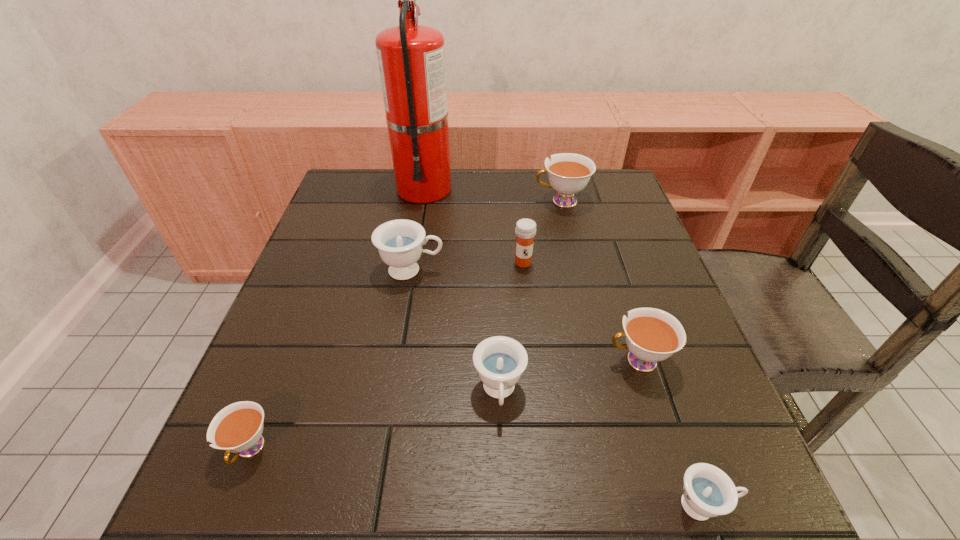
Identify the location of red fire extinguisher. (411, 58).

Locate an element on the screen. The image size is (960, 540). fire extinguisher is located at coordinates (411, 58).

The image size is (960, 540). I want to click on the farthest white teacup, so (x=568, y=173).

You are a GUI agent. You are given a task and a screenshot of the screen. Output one action in this format:
    pyautogui.click(x=<x>, y=<y>)
    Task: Click on the farthest teacup
    
    Given the screenshot: What is the action you would take?
    pyautogui.click(x=568, y=173)

You are a GUI agent. You are given a task and a screenshot of the screen. Output one action in this format:
    pyautogui.click(x=<x>, y=<y>)
    Task: Click on the medicine
    
    Given the screenshot: What is the action you would take?
    pyautogui.click(x=525, y=230)

At what (x,y) coordinates should I click in order to perform the action: click on the biggest blue teacup. Please return your answer as a coordinate pair (x, y). The height and width of the screenshot is (540, 960). Looking at the image, I should click on (399, 242).

Find the location of a particular element. The height and width of the screenshot is (540, 960). the leftmost blue teacup is located at coordinates (399, 242).

Find the location of `the second smallest white teacup`. the second smallest white teacup is located at coordinates (652, 335).

At what (x,y) coordinates should I click in order to perform the action: click on the second nearest blue teacup. Please return your answer as a coordinate pair (x, y). Looking at the image, I should click on (500, 361).

Identify the location of the second biggest blue teacup. The width and height of the screenshot is (960, 540). (500, 361).